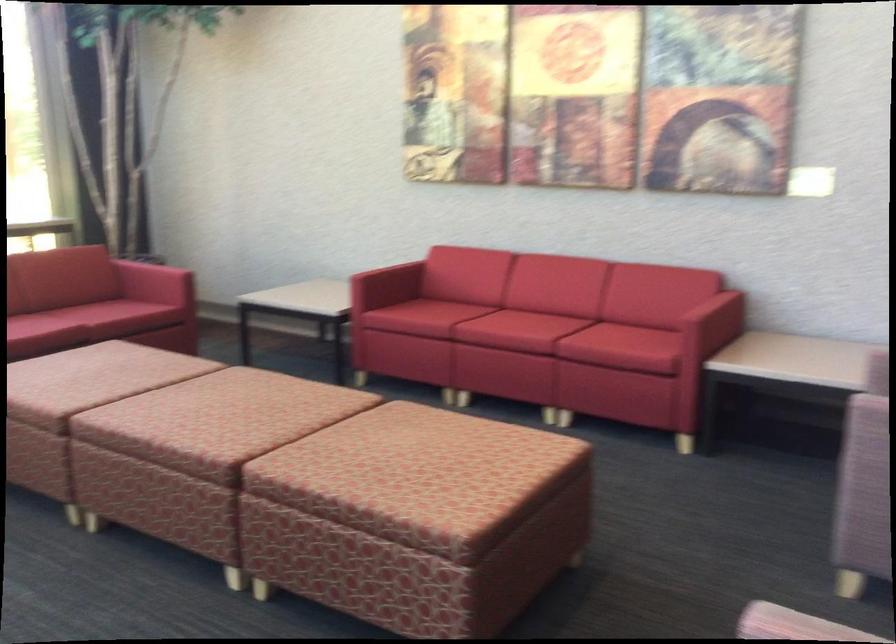
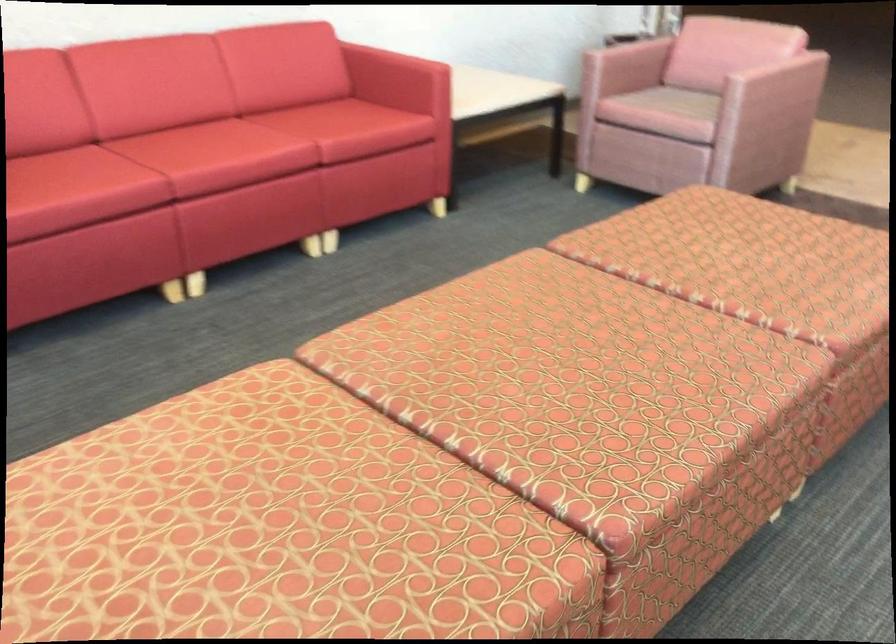
Where in the second image is the point corresponding to the point at 113,368 from the first image?

(250, 522)